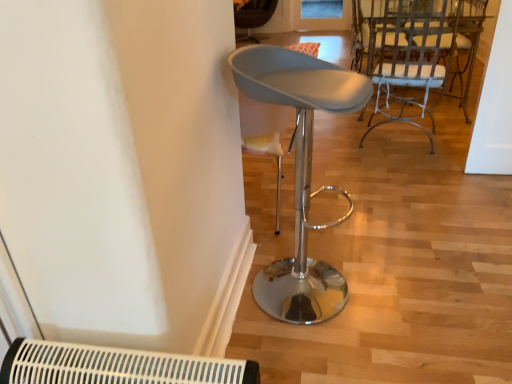
Identify the location of vacant space to the right of matte gray stool at center, marked as the 2th chair in a left-to-right arrangement. The height and width of the screenshot is (384, 512). (400, 302).